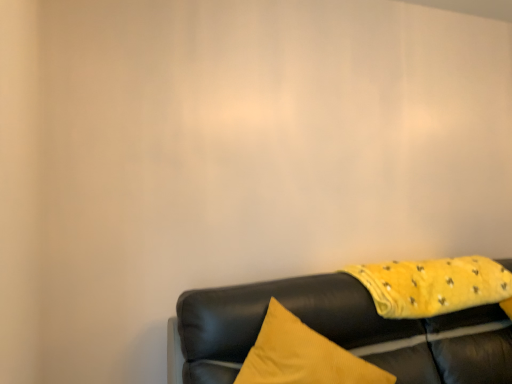
Where is `yellow soft fabric blanket at lower right`? The height and width of the screenshot is (384, 512). yellow soft fabric blanket at lower right is located at coordinates (433, 285).

What do you see at coordinates (433, 285) in the screenshot? The image size is (512, 384). I see `yellow soft fabric blanket at lower right` at bounding box center [433, 285].

Where is `leather couch at lower right`? This screenshot has height=384, width=512. leather couch at lower right is located at coordinates (338, 332).

The height and width of the screenshot is (384, 512). Describe the element at coordinates (338, 332) in the screenshot. I see `leather couch at lower right` at that location.

Identify the location of yellow soft fabric blanket at lower right. (433, 285).

Is yellow soft fabric blanket at lower right at the right side of leather couch at lower right?

Yes, yellow soft fabric blanket at lower right is to the right of leather couch at lower right.

Considering the relative positions of yellow soft fabric blanket at lower right and leather couch at lower right in the image provided, is yellow soft fabric blanket at lower right in front of leather couch at lower right?

No, yellow soft fabric blanket at lower right is behind leather couch at lower right.

Which is behind, point (412, 280) or point (396, 350)?

The point (412, 280) is farther from the camera.

From the image's perspective, who appears lower, yellow soft fabric blanket at lower right or leather couch at lower right?

leather couch at lower right, from the image's perspective.

From a real-world perspective, who is located lower, yellow soft fabric blanket at lower right or leather couch at lower right?

leather couch at lower right, from a real-world perspective.

Which of these two, yellow soft fabric blanket at lower right or leather couch at lower right, is wider?

leather couch at lower right is wider.

Consider the image. Considering the relative sizes of yellow soft fabric blanket at lower right and leather couch at lower right in the image provided, is yellow soft fabric blanket at lower right taller than leather couch at lower right?

No.

Is yellow soft fabric blanket at lower right bigger than leather couch at lower right?

Actually, yellow soft fabric blanket at lower right might be smaller than leather couch at lower right.

Is yellow soft fabric blanket at lower right located outside leather couch at lower right?

No, yellow soft fabric blanket at lower right is not outside of leather couch at lower right.

Is yellow soft fabric blanket at lower right not near leather couch at lower right?

No, yellow soft fabric blanket at lower right is not far from leather couch at lower right.

Is yellow soft fabric blanket at lower right oriented away from leather couch at lower right?

That's right, yellow soft fabric blanket at lower right is facing away from leather couch at lower right.

Locate an element on the screen. The height and width of the screenshot is (384, 512). studio couch located in front of the yellow soft fabric blanket at lower right is located at coordinates click(338, 332).

Considering the positions of objects leather couch at lower right and yellow soft fabric blanket at lower right in the image provided, who is more to the right, leather couch at lower right or yellow soft fabric blanket at lower right?

yellow soft fabric blanket at lower right.

Considering the relative positions of leather couch at lower right and yellow soft fabric blanket at lower right in the image provided, is leather couch at lower right in front of yellow soft fabric blanket at lower right?

Yes, leather couch at lower right is in front of yellow soft fabric blanket at lower right.

Is point (478, 356) closer or farther from the camera than point (420, 300)?

Point (478, 356) appears to be farther away from the viewer than point (420, 300).

Looking at this image, from the image's perspective, is leather couch at lower right located above yellow soft fabric blanket at lower right?

No, from the image's perspective, leather couch at lower right is not on top of yellow soft fabric blanket at lower right.

From a real-world perspective, is leather couch at lower right positioned under yellow soft fabric blanket at lower right based on gravity?

Yes.

Which of these two, leather couch at lower right or yellow soft fabric blanket at lower right, is thinner?

yellow soft fabric blanket at lower right is thinner.

Who is shorter, leather couch at lower right or yellow soft fabric blanket at lower right?

With less height is yellow soft fabric blanket at lower right.

In terms of size, does leather couch at lower right appear bigger or smaller than yellow soft fabric blanket at lower right?

Clearly, leather couch at lower right is larger in size than yellow soft fabric blanket at lower right.

Would you say leather couch at lower right is inside or outside yellow soft fabric blanket at lower right?

leather couch at lower right is not inside yellow soft fabric blanket at lower right, it's outside.

Is leather couch at lower right not close to yellow soft fabric blanket at lower right?

No, leather couch at lower right is not far from yellow soft fabric blanket at lower right.

Is leather couch at lower right turned away from yellow soft fabric blanket at lower right?

Yes, leather couch at lower right is facing away from yellow soft fabric blanket at lower right.

You are a GUI agent. You are given a task and a screenshot of the screen. Output one action in this format:
    pyautogui.click(x=<x>, y=<y>)
    Task: Click on the blanket that is on the right side of leather couch at lower right
    The height and width of the screenshot is (384, 512).
    Given the screenshot: What is the action you would take?
    pyautogui.click(x=433, y=285)

Find the location of a particular element. The image size is (512, 384). studio couch below the yellow soft fabric blanket at lower right (from the image's perspective) is located at coordinates coord(338,332).

Identify the location of studio couch on the left of yellow soft fabric blanket at lower right. (338, 332).